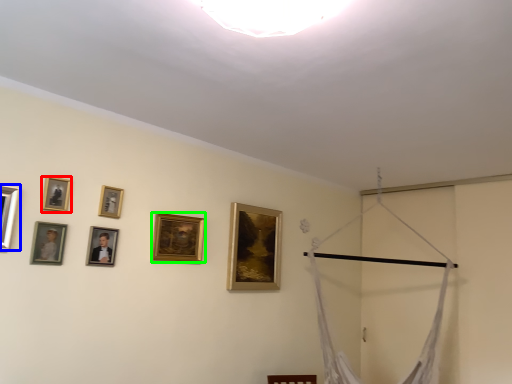
Question: Which is nearer to the picture frame (highlighted by a red box)? picture frame (highlighted by a blue box) or picture frame (highlighted by a green box).

Choices:
 (A) picture frame
 (B) picture frame

Answer: (A)